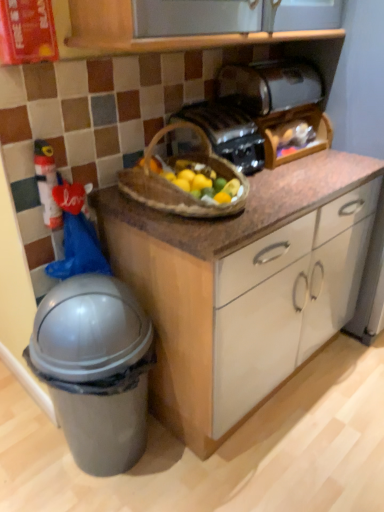
Question: Considering the positions of plastic fire extinguisher at left and brown woven picnic basket at center in the image, is plastic fire extinguisher at left wider or thinner than brown woven picnic basket at center?

Choices:
 (A) wide
 (B) thin

Answer: (B)

Question: Is plastic fire extinguisher at left bigger or smaller than brown woven picnic basket at center?

Choices:
 (A) big
 (B) small

Answer: (B)

Question: Considering the real-world distances, which object is farthest from the brown woven picnic basket at center?

Choices:
 (A) satin black toaster at upper center, acting as the 2th toaster starting from the bottom
 (B) plastic fire extinguisher at left
 (C) gray plastic trash can at lower left
 (D) matte black toaster at center, the 1th toaster from the bottom

Answer: (C)

Question: Which object is positioned closest to the matte black toaster at center, the 1th toaster from the bottom?

Choices:
 (A) brown woven picnic basket at center
 (B) plastic fire extinguisher at left
 (C) gray plastic trash can at lower left
 (D) satin black toaster at upper center, marked as the first toaster in a top-to-bottom arrangement

Answer: (A)